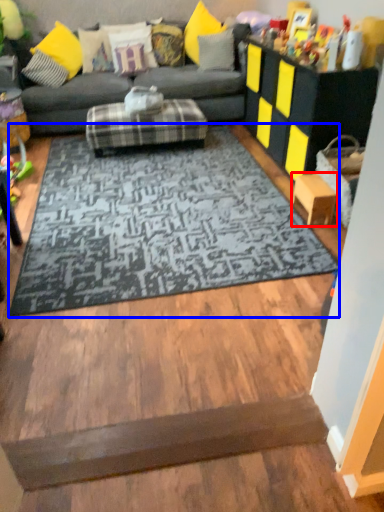
Question: Which point is closer to the camera, stool (highlighted by a red box) or mat (highlighted by a blue box)?

Choices:
 (A) stool
 (B) mat

Answer: (B)